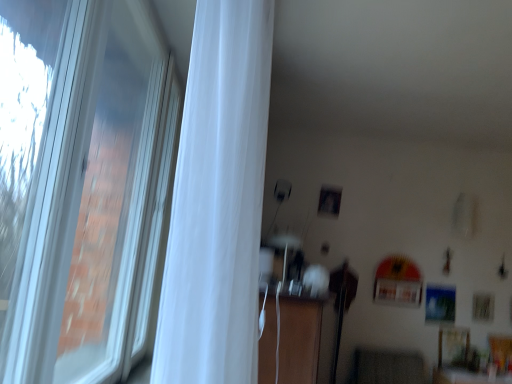
Question: Is white plastic window at left positioned behind white sheer curtain at left?

Choices:
 (A) no
 (B) yes

Answer: (A)

Question: Does white plastic window at left have a greater width compared to white sheer curtain at left?

Choices:
 (A) no
 (B) yes

Answer: (A)

Question: Is white plastic window at left smaller than white sheer curtain at left?

Choices:
 (A) no
 (B) yes

Answer: (A)

Question: From the image's perspective, is white plastic window at left on top of white sheer curtain at left?

Choices:
 (A) no
 (B) yes

Answer: (A)

Question: Is white plastic window at left positioned in front of white sheer curtain at left?

Choices:
 (A) no
 (B) yes

Answer: (B)

Question: From the image's perspective, is wooden dresser at center located above or below white plastic window at left?

Choices:
 (A) above
 (B) below

Answer: (B)

Question: In terms of width, does wooden dresser at center look wider or thinner when compared to white plastic window at left?

Choices:
 (A) thin
 (B) wide

Answer: (B)

Question: Based on their sizes in the image, would you say wooden dresser at center is bigger or smaller than white plastic window at left?

Choices:
 (A) small
 (B) big

Answer: (B)

Question: Considering the relative positions of wooden dresser at center and white plastic window at left in the image provided, is wooden dresser at center to the left or to the right of white plastic window at left?

Choices:
 (A) left
 (B) right

Answer: (B)

Question: Is white plastic window at left taller or shorter than wooden dresser at center?

Choices:
 (A) tall
 (B) short

Answer: (A)

Question: In terms of size, does white plastic window at left appear bigger or smaller than wooden dresser at center?

Choices:
 (A) big
 (B) small

Answer: (B)

Question: Is point (115, 107) positioned closer to the camera than point (258, 354)?

Choices:
 (A) closer
 (B) farther

Answer: (B)

Question: Based on their positions, is white plastic window at left located to the left or right of wooden dresser at center?

Choices:
 (A) left
 (B) right

Answer: (A)

Question: From the image's perspective, is white sheer curtain at left located above or below white plastic window at left?

Choices:
 (A) above
 (B) below

Answer: (A)

Question: From a real-world perspective, relative to white plastic window at left, is white sheer curtain at left vertically above or below?

Choices:
 (A) below
 (B) above

Answer: (B)